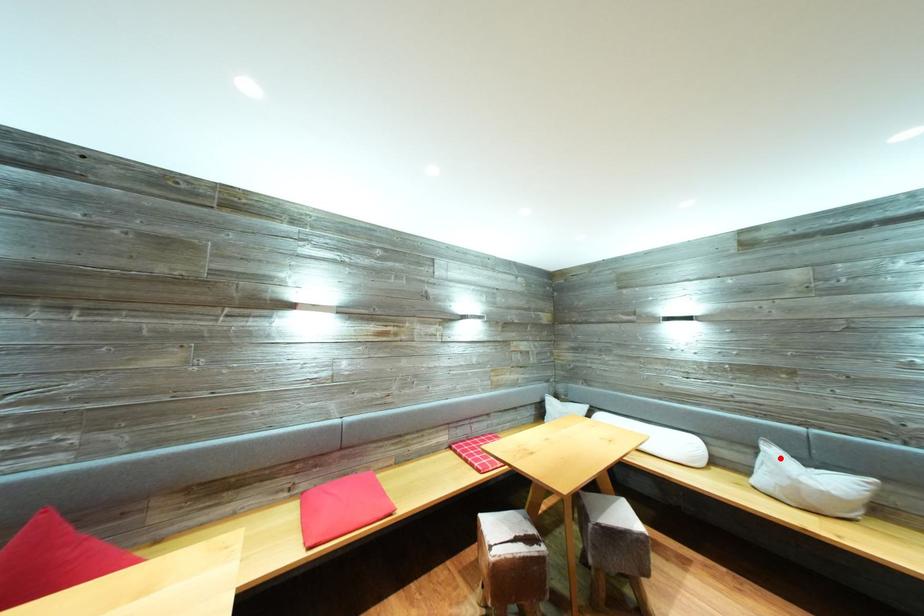
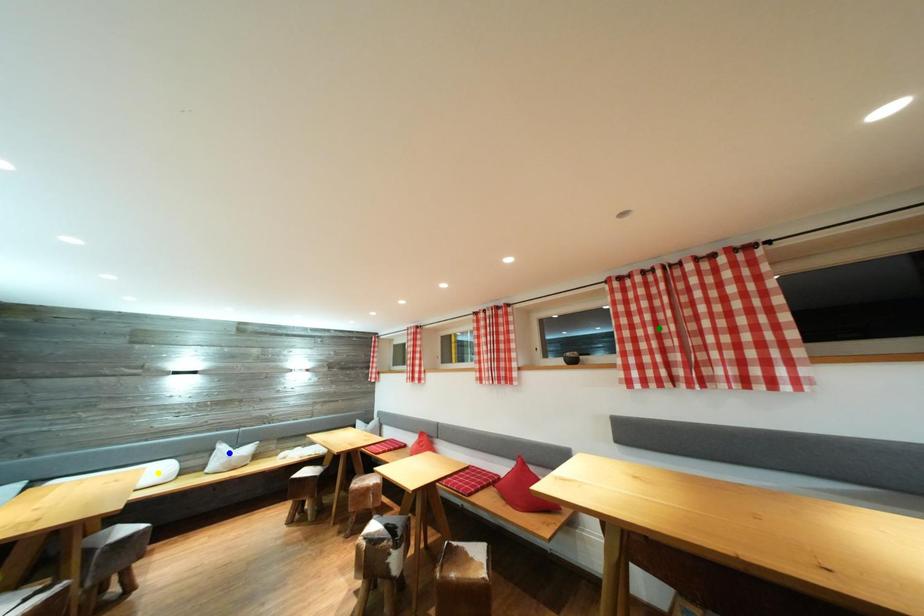
Question: I am providing you with two images of the same scene from different viewpoints. A red point is marked on the first image. You are given multiple points on the second image. Which spot in image 2 lines up with the point in image 1?

Choices:
 (A) green point
 (B) yellow point
 (C) blue point

Answer: (C)